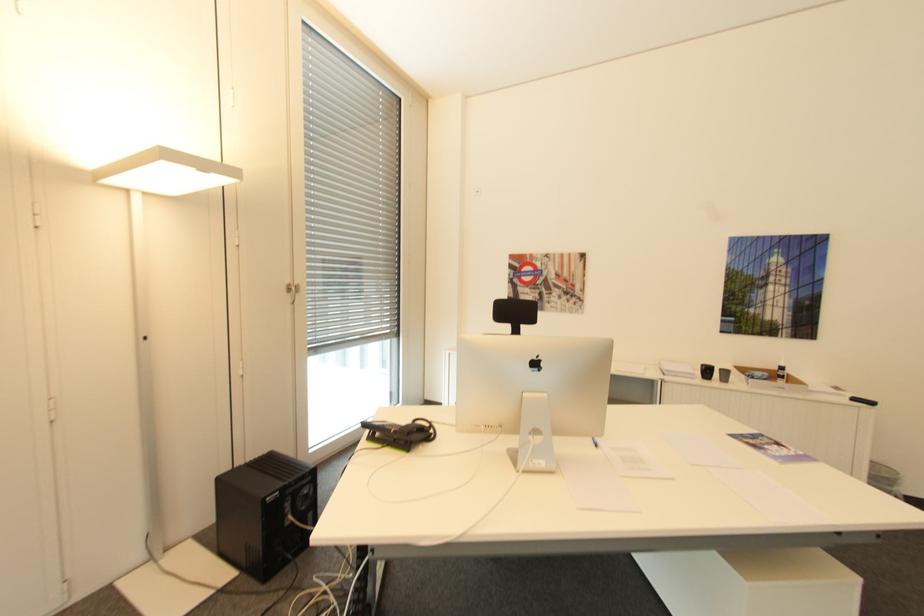
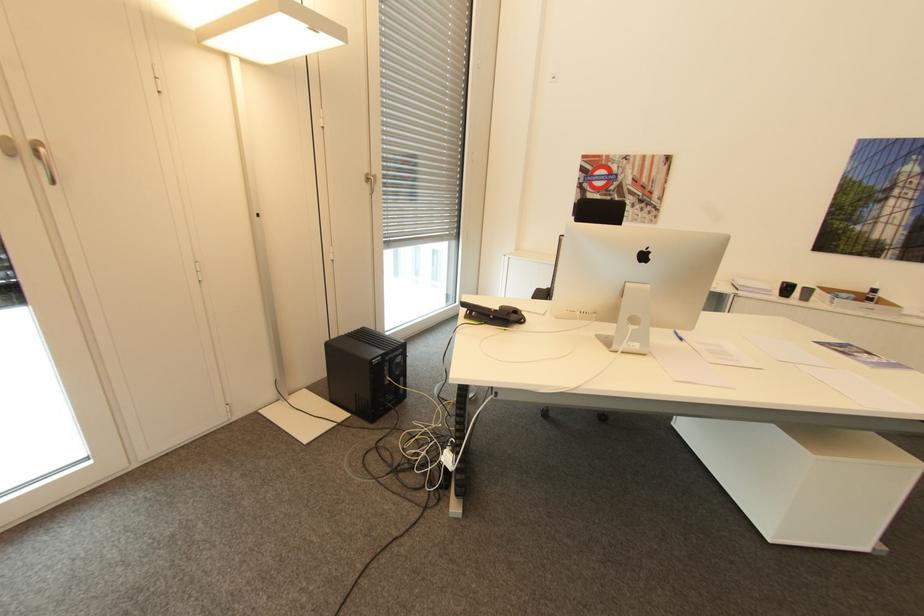
Find the pixel in the second image that matches pixel 786 368 in the first image.

(879, 290)